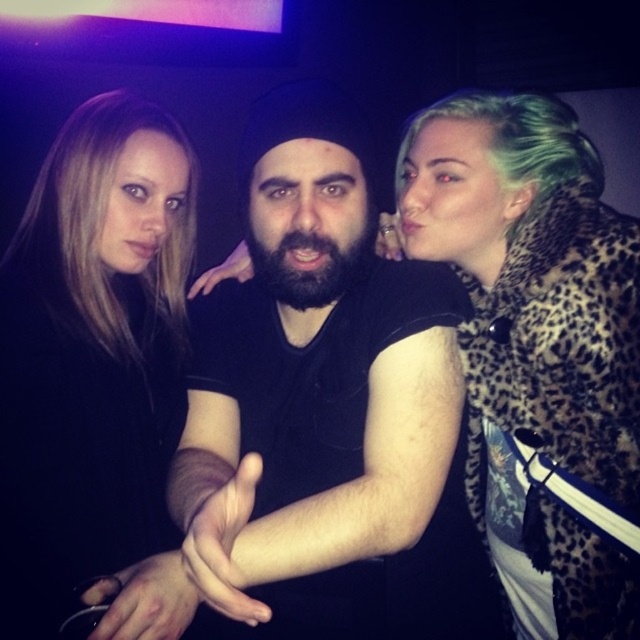
Question: Among these objects, which one is nearest to the camera?

Choices:
 (A) leopard print coat at right
 (B) matte black shirt at center
 (C) black matte shirt at center

Answer: (C)

Question: Can you confirm if black matte shirt at center is positioned to the left of matte black shirt at center?

Choices:
 (A) yes
 (B) no

Answer: (B)

Question: Which point appears farthest from the camera in this image?

Choices:
 (A) (476, 214)
 (B) (172, 164)

Answer: (B)

Question: Which object is the farthest from the leopard print coat at right?

Choices:
 (A) matte black shirt at center
 (B) black matte shirt at center

Answer: (A)

Question: Is leopard print coat at right to the left of matte black shirt at center from the viewer's perspective?

Choices:
 (A) yes
 (B) no

Answer: (B)

Question: Can you confirm if leopard print coat at right is positioned to the right of matte black shirt at center?

Choices:
 (A) no
 (B) yes

Answer: (B)